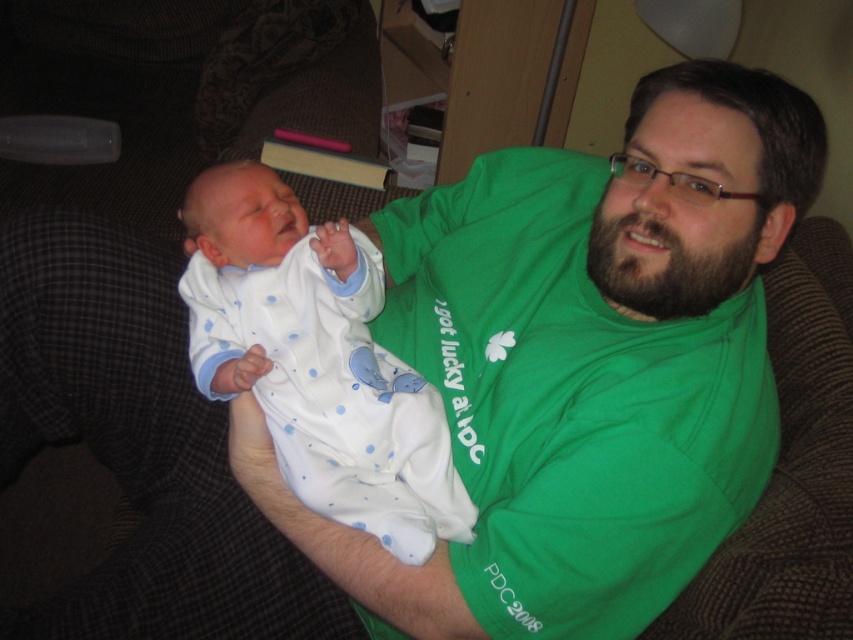
You are a photographer preparing to take a photo of the man and the baby. You need to ensure that both the green cotton shirt at center and the white soft fabric newborn at center are fully visible in the frame. Given that the shirt is wider than the baby, which object should you position closer to the center of the frame to avoid cropping either?

Since the green cotton shirt at center is wider than the white soft fabric newborn at center, you should position the green cotton shirt at center closer to the center of the frame to ensure both fit without cropping.

You are a photographer trying to capture a candid shot of the man and baby in the scene. You notice a specific point at coordinates (582, 364). Where is this point located in relation to the green cotton shirt at center?

The point at coordinates (582, 364) is located on the green cotton shirt at center.